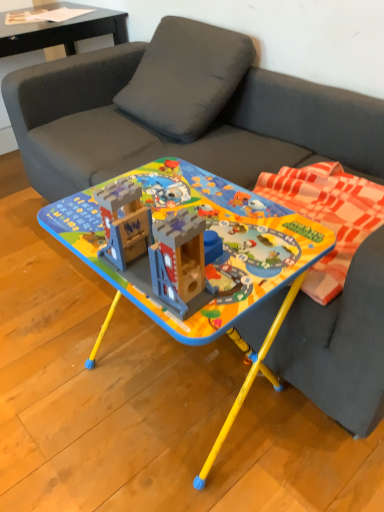
This screenshot has width=384, height=512. I want to click on vacant space positioned to the left of matte plastic table at center, the 1th table when ordered from right to left, so 55,376.